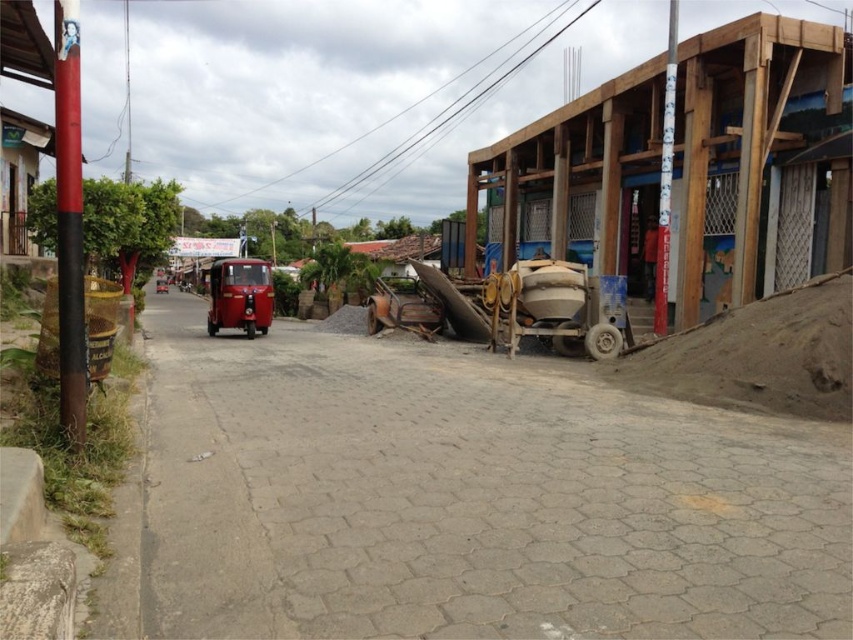
Consider the image. Between smooth concrete alley at center and shiny red tuk-tuk at center, which one is positioned higher?

shiny red tuk-tuk at center is above.

Can you confirm if smooth concrete alley at center is bigger than shiny red tuk-tuk at center?

No, smooth concrete alley at center is not bigger than shiny red tuk-tuk at center.

Measure the distance between smooth concrete alley at center and camera.

smooth concrete alley at center is 9.37 feet away from camera.

This screenshot has height=640, width=853. Identify the location of smooth concrete alley at center. [471, 497].

Which is in front, point (544, 301) or point (216, 323)?

Point (544, 301)

Can you confirm if matte gray concrete mixer at center-right is bigger than shiny red tuk-tuk at center?

Incorrect, matte gray concrete mixer at center-right is not larger than shiny red tuk-tuk at center.

Which is in front, point (543, 276) or point (221, 316)?

Point (543, 276)

Where is `matte gray concrete mixer at center-right`? matte gray concrete mixer at center-right is located at coordinates (550, 308).

Between smooth concrete alley at center and matte gray concrete mixer at center-right, which one is positioned higher?

matte gray concrete mixer at center-right

Is smooth concrete alley at center smaller than matte gray concrete mixer at center-right?

Actually, smooth concrete alley at center might be larger than matte gray concrete mixer at center-right.

Who is more distant from viewer, (175, 577) or (613, 316)?

The point (613, 316) is more distant.

Find the location of a particular element. Image resolution: width=853 pixels, height=640 pixels. smooth concrete alley at center is located at coordinates (471, 497).